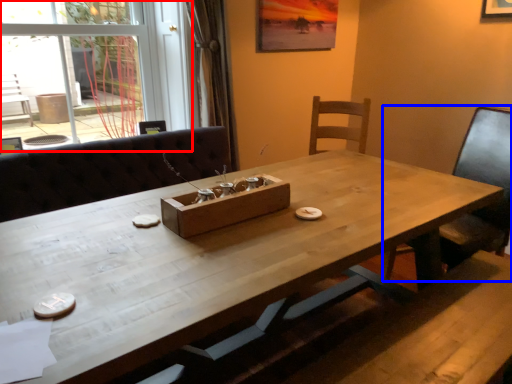
Question: Which object is closer to the camera taking this photo, glass door (highlighted by a red box) or chair (highlighted by a blue box)?

Choices:
 (A) glass door
 (B) chair

Answer: (B)